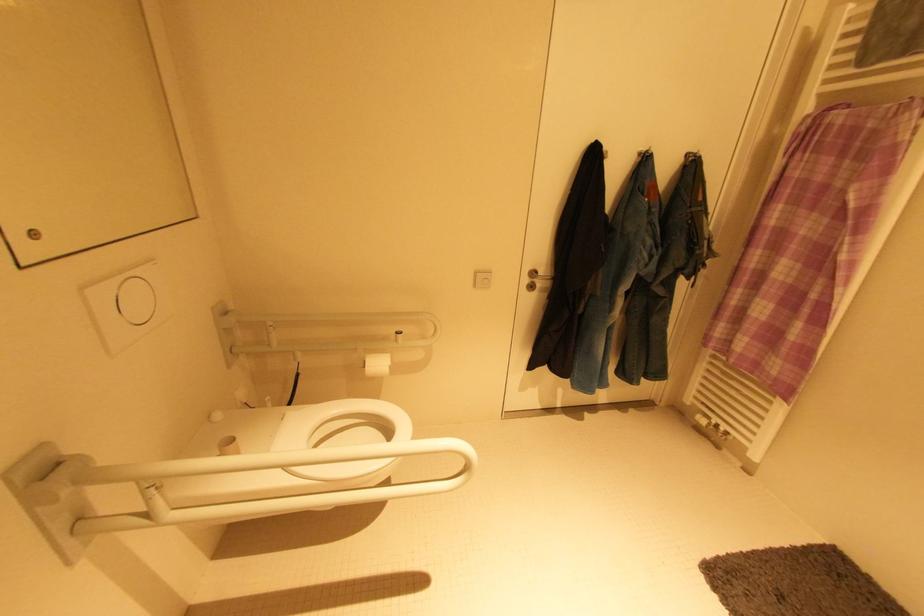
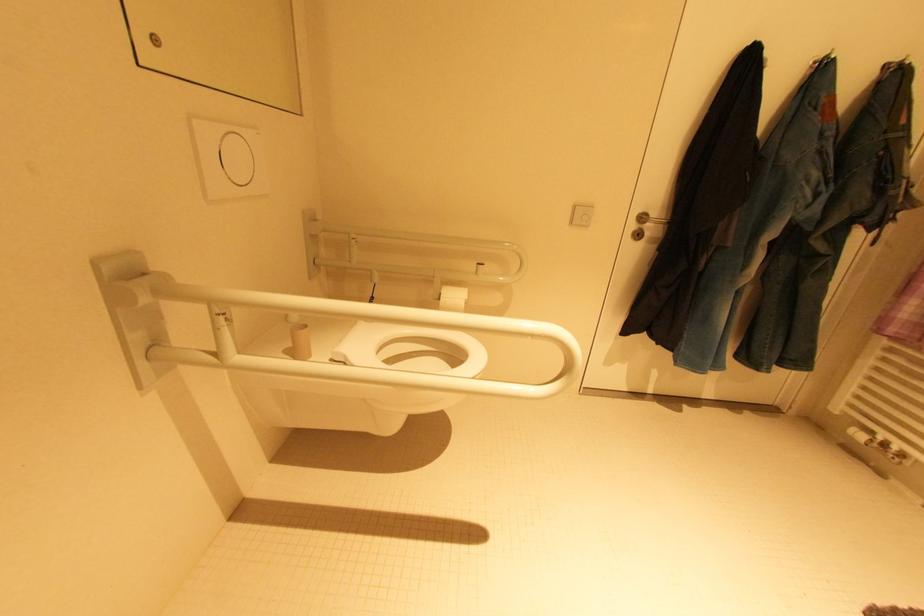
Based on the photo, which direction would the cameraman need to move to produce the second image?

The cameraman walked toward left, forward.